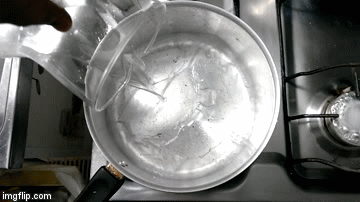
You are a GUI agent. You are given a task and a screenshot of the screen. Output one action in this format:
    pyautogui.click(x=<x>, y=<y>)
    Task: Click on the burner
    
    Given the screenshot: What is the action you would take?
    pyautogui.click(x=352, y=119), pyautogui.click(x=35, y=188)